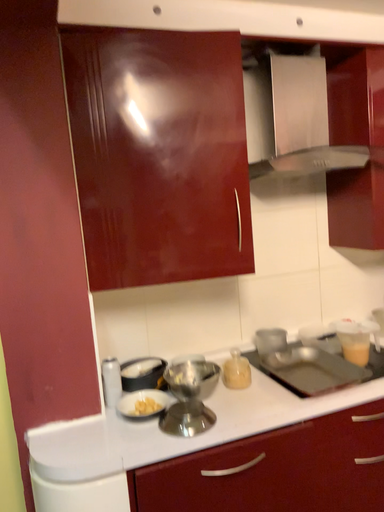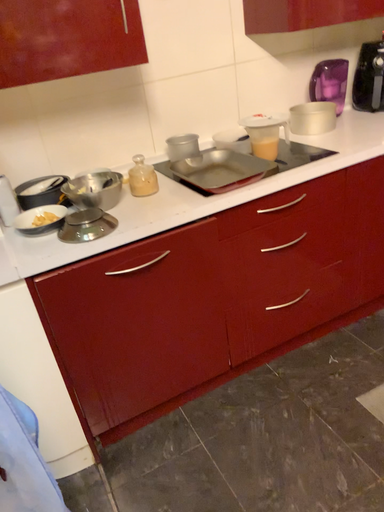
Question: How did the camera likely rotate when shooting the video?

Choices:
 (A) rotated right
 (B) rotated left

Answer: (A)